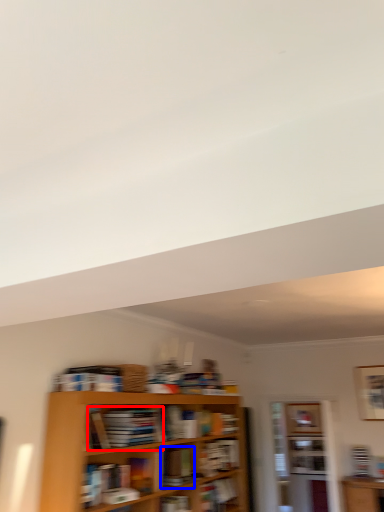
Question: Which of the following is the closest to the observer, book (highlighted by a red box) or book (highlighted by a blue box)?

Choices:
 (A) book
 (B) book

Answer: (A)